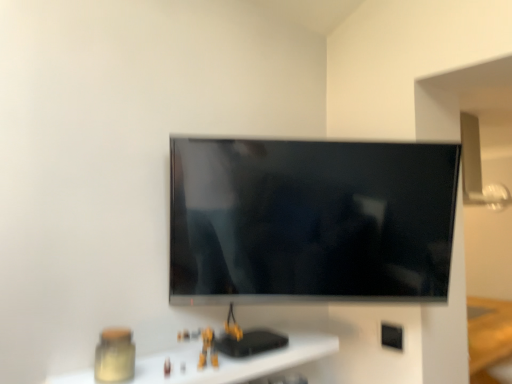
Where is `vacant space situated above matte glass jar at lower left (from a real-world perspective)`? vacant space situated above matte glass jar at lower left (from a real-world perspective) is located at coordinates (192, 355).